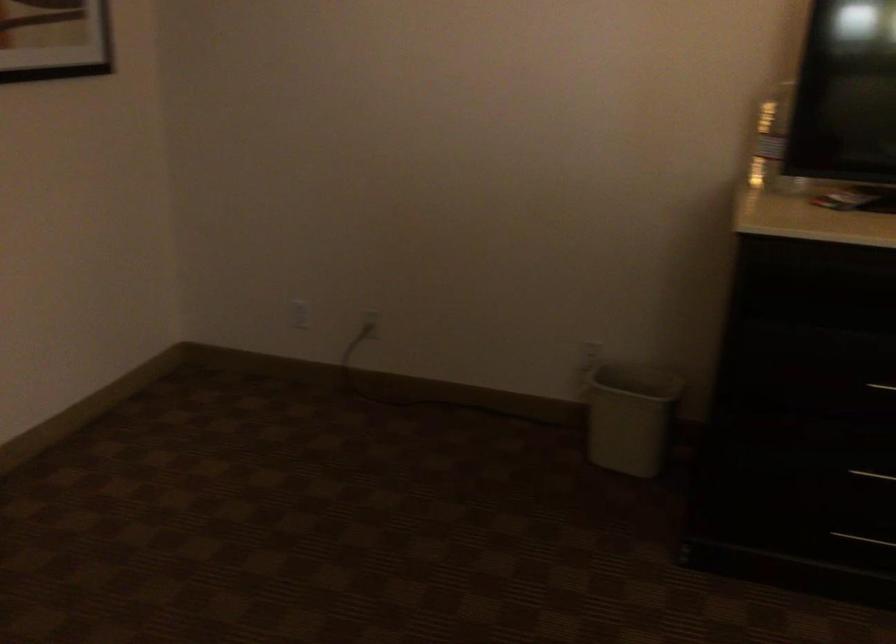
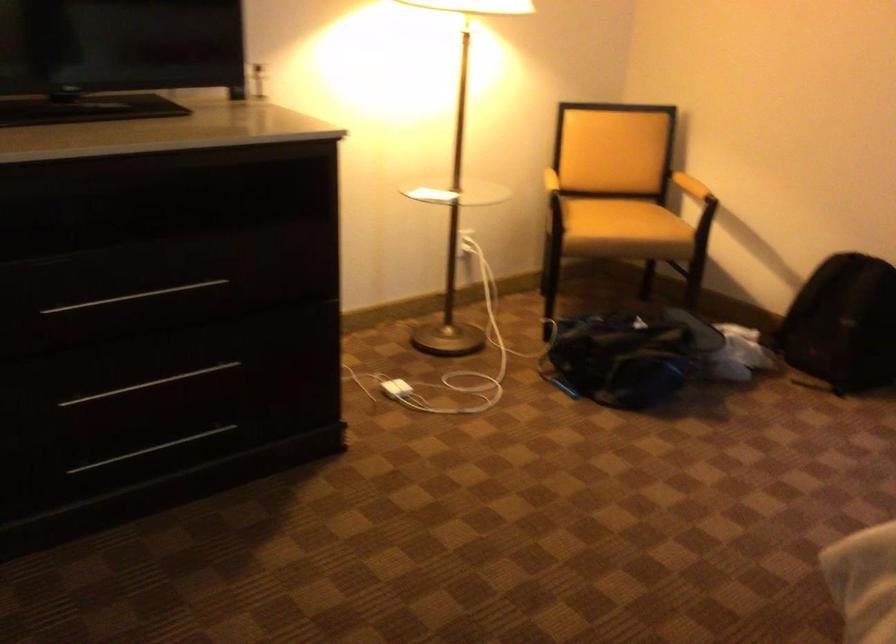
Question: The camera is either moving clockwise (left) or counter-clockwise (right) around the object. The first image is from the beginning of the video and the second image is from the end. Is the camera moving left or right when shooting the video?

Choices:
 (A) Left
 (B) Right

Answer: (A)